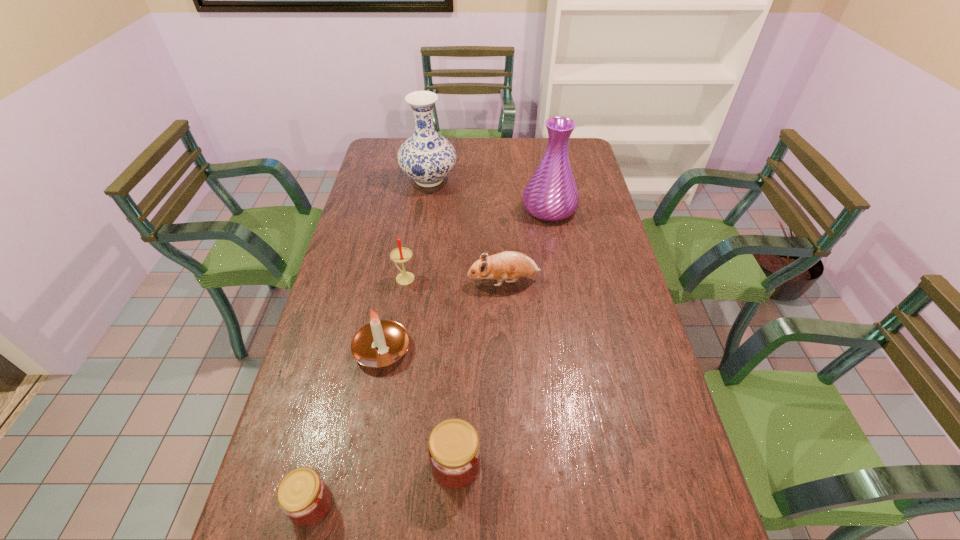
Find the location of `object that stands as the closest to the nearer candle`. object that stands as the closest to the nearer candle is located at coordinates (399, 255).